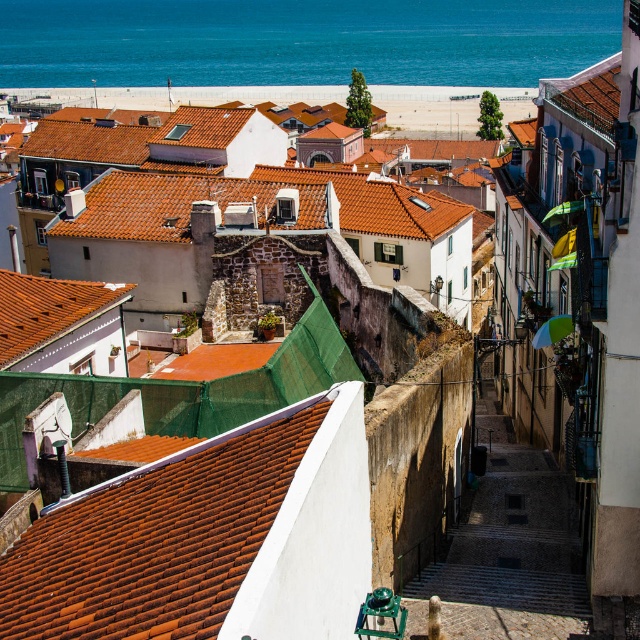
Who is taller, stone textured stairs at center or white sand beach at center?

white sand beach at center

Can you confirm if stone textured stairs at center is positioned above white sand beach at center?

Incorrect, stone textured stairs at center is not positioned above white sand beach at center.

Measure the distance between point (467, 612) and camera.

A distance of 23.08 meters exists between point (467, 612) and camera.

Where is `stone textured stairs at center`? The width and height of the screenshot is (640, 640). stone textured stairs at center is located at coordinates (508, 548).

Is white sand beach at center smaller than orange tiled roof at center-left?

Incorrect, white sand beach at center is not smaller in size than orange tiled roof at center-left.

Is point (52, 88) closer to viewer compared to point (96, 291)?

No, it is not.

Image resolution: width=640 pixels, height=640 pixels. Identify the location of white sand beach at center. (445, 108).

Is point (232, 17) positioned behind point (346, 232)?

Yes, it is behind point (346, 232).

Can you confirm if blue water at upper center is thinner than orange tiled roof at center?

No, blue water at upper center is not thinner than orange tiled roof at center.

Is point (304, 58) positioned after point (378, 209)?

Yes.

Where is `blue water at upper center`? The height and width of the screenshot is (640, 640). blue water at upper center is located at coordinates (301, 42).